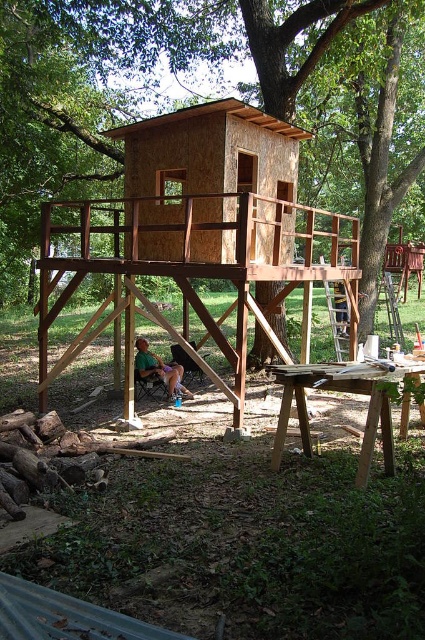
You are a visitor standing on the ground looking up at the wooden cabin at center. Can you see the green fabric shirt at lower center from your current position?

Yes, the green fabric shirt at lower center is below the wooden cabin at center, so you can see it from your position on the ground.

You are standing in front of the treehouse and want to know which of the two points, point (212,177) or point (181,392), is closer to you. Based on the coordinates provided, can you determine which point is nearer?

Point (212,177) is closer to the camera than point (181,392), so it is the nearer one.

You are planning to build a structure in your backyard. You have two options based on the image provided. Which one would you choose if you want a larger living space? Please refer to the wooden treehouse at center and the wooden cabin at center in your answer.

The wooden treehouse at center is bigger than the wooden cabin at center, so you should choose the wooden treehouse at center for a larger living space.